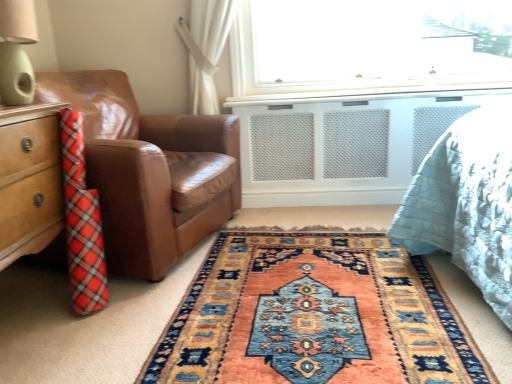
The image size is (512, 384). Find the location of `carpet with intricate patterns at center`. carpet with intricate patterns at center is located at coordinates (314, 316).

This screenshot has width=512, height=384. Describe the element at coordinates (16, 51) in the screenshot. I see `matte green lampshade at upper left` at that location.

Where is `brown leather chair at left`? The height and width of the screenshot is (384, 512). brown leather chair at left is located at coordinates (149, 171).

What is the approximate width of brown leather chair at left?

It is 34.80 inches.

Where is `carpet with intricate patterns at center`? This screenshot has width=512, height=384. carpet with intricate patterns at center is located at coordinates (314, 316).

You are a GUI agent. You are given a task and a screenshot of the screen. Output one action in this format:
    pyautogui.click(x=<x>, y=<y>)
    Task: Click on the table lamp lying on the left of carpet with intricate patterns at center
    The image size is (512, 384).
    Given the screenshot: What is the action you would take?
    pyautogui.click(x=16, y=51)

Does matte green lampshade at upper left have a larger size compared to carpet with intricate patterns at center?

Actually, matte green lampshade at upper left might be smaller than carpet with intricate patterns at center.

How many degrees apart are the facing directions of matte green lampshade at upper left and carpet with intricate patterns at center?

The angle between the facing direction of matte green lampshade at upper left and the facing direction of carpet with intricate patterns at center is 176 degrees.

From the image's perspective, is brown leather chair at left located above or below matte green lampshade at upper left?

From the image's perspective, brown leather chair at left appears below matte green lampshade at upper left.

Considering the relative sizes of brown leather chair at left and matte green lampshade at upper left in the image provided, is brown leather chair at left smaller than matte green lampshade at upper left?

No, brown leather chair at left is not smaller than matte green lampshade at upper left.

Looking at their sizes, would you say brown leather chair at left is wider or thinner than matte green lampshade at upper left?

brown leather chair at left is wider than matte green lampshade at upper left.

Would you say brown leather chair at left contains matte green lampshade at upper left?

No, matte green lampshade at upper left is not surrounded by brown leather chair at left.

Is brown leather chair at left situated inside carpet with intricate patterns at center or outside?

brown leather chair at left is spatially situated outside carpet with intricate patterns at center.

Image resolution: width=512 pixels, height=384 pixels. Identify the location of mat that appears on the right of brown leather chair at left. (314, 316).

Based on the photo, which object is closer to the camera, brown leather chair at left or carpet with intricate patterns at center?

carpet with intricate patterns at center is in front.

Based on the photo, can you confirm if carpet with intricate patterns at center is positioned to the left of matte green lampshade at upper left?

No, carpet with intricate patterns at center is not to the left of matte green lampshade at upper left.

Based on the photo, who is taller, carpet with intricate patterns at center or matte green lampshade at upper left?

With more height is matte green lampshade at upper left.

Is there a large distance between carpet with intricate patterns at center and matte green lampshade at upper left?

carpet with intricate patterns at center is far away from matte green lampshade at upper left.

From the image's perspective, which is above, carpet with intricate patterns at center or matte green lampshade at upper left?

From the image's view, matte green lampshade at upper left is above.

Between matte green lampshade at upper left and brown leather chair at left, which one appears on the left side from the viewer's perspective?

matte green lampshade at upper left is more to the left.

In the scene shown: How many degrees apart are the facing directions of matte green lampshade at upper left and brown leather chair at left?

17.2 degrees separate the facing orientations of matte green lampshade at upper left and brown leather chair at left.

From a real-world perspective, does matte green lampshade at upper left sit lower than brown leather chair at left?

Actually, matte green lampshade at upper left is physically above brown leather chair at left in the real world.

Based on the photo, considering the relative sizes of carpet with intricate patterns at center and brown leather chair at left in the image provided, is carpet with intricate patterns at center bigger than brown leather chair at left?

Actually, carpet with intricate patterns at center might be smaller than brown leather chair at left.

At what (x,y) coordinates should I click in order to perform the action: click on mat located below the brown leather chair at left (from the image's perspective). Please return your answer as a coordinate pair (x, y). This screenshot has width=512, height=384. Looking at the image, I should click on (314, 316).

Looking at this image, is carpet with intricate patterns at center facing towards brown leather chair at left?

No.

Is brown leather chair at left inside carpet with intricate patterns at center?

No, brown leather chair at left is not inside carpet with intricate patterns at center.

Where is `mat below the matte green lampshade at upper left (from a real-world perspective)`? This screenshot has width=512, height=384. mat below the matte green lampshade at upper left (from a real-world perspective) is located at coordinates (314, 316).

Where is `table lamp above the brown leather chair at left (from a real-world perspective)`? This screenshot has height=384, width=512. table lamp above the brown leather chair at left (from a real-world perspective) is located at coordinates (16, 51).

Considering their positions, is carpet with intricate patterns at center positioned further to brown leather chair at left than matte green lampshade at upper left?

carpet with intricate patterns at center is positioned further to the anchor brown leather chair at left.

Considering their positions, is carpet with intricate patterns at center positioned further to matte green lampshade at upper left than brown leather chair at left?

carpet with intricate patterns at center.

From the image, which object appears to be farther from carpet with intricate patterns at center, matte green lampshade at upper left or brown leather chair at left?

matte green lampshade at upper left.

When comparing their distances from carpet with intricate patterns at center, does brown leather chair at left or matte green lampshade at upper left seem closer?

Among the two, brown leather chair at left is located nearer to carpet with intricate patterns at center.

When comparing their distances from matte green lampshade at upper left, does brown leather chair at left or carpet with intricate patterns at center seem further?

carpet with intricate patterns at center lies further to matte green lampshade at upper left than the other object.

From the image, which object appears to be nearer to brown leather chair at left, matte green lampshade at upper left or carpet with intricate patterns at center?

matte green lampshade at upper left lies closer to brown leather chair at left than the other object.

Locate an element on the screen. The height and width of the screenshot is (384, 512). chair between matte green lampshade at upper left and carpet with intricate patterns at center from left to right is located at coordinates [x=149, y=171].